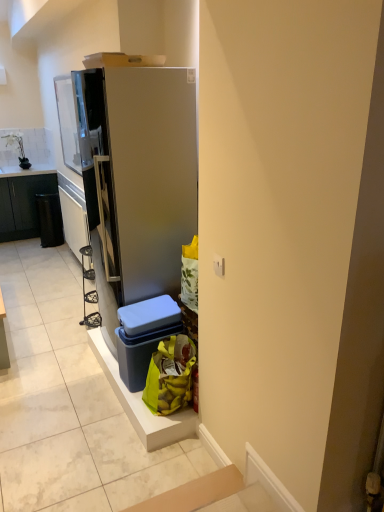
Question: From a real-world perspective, does black plastic recycling bin at left sit lower than blue plastic storage box at lower center?

Choices:
 (A) no
 (B) yes

Answer: (B)

Question: Is black plastic recycling bin at left to the right of blue plastic storage box at lower center from the viewer's perspective?

Choices:
 (A) yes
 (B) no

Answer: (B)

Question: Does black plastic recycling bin at left lie in front of blue plastic storage box at lower center?

Choices:
 (A) yes
 (B) no

Answer: (B)

Question: Would you say black plastic recycling bin at left contains blue plastic storage box at lower center?

Choices:
 (A) yes
 (B) no

Answer: (B)

Question: From the image's perspective, is black plastic recycling bin at left beneath blue plastic storage box at lower center?

Choices:
 (A) yes
 (B) no

Answer: (B)

Question: From the image's perspective, is black plastic recycling bin at left located above blue plastic storage box at lower center?

Choices:
 (A) no
 (B) yes

Answer: (B)

Question: From the image's perspective, is metallic silver shelf at left beneath blue plastic storage box at lower center?

Choices:
 (A) no
 (B) yes

Answer: (A)

Question: Could blue plastic storage box at lower center be considered to be inside metallic silver shelf at left?

Choices:
 (A) no
 (B) yes

Answer: (A)

Question: Considering the relative positions of metallic silver shelf at left and blue plastic storage box at lower center in the image provided, is metallic silver shelf at left behind blue plastic storage box at lower center?

Choices:
 (A) yes
 (B) no

Answer: (A)

Question: Is metallic silver shelf at left completely or partially outside of blue plastic storage box at lower center?

Choices:
 (A) no
 (B) yes

Answer: (B)

Question: Considering the relative sizes of metallic silver shelf at left and blue plastic storage box at lower center in the image provided, is metallic silver shelf at left thinner than blue plastic storage box at lower center?

Choices:
 (A) no
 (B) yes

Answer: (B)

Question: Could you tell me if metallic silver shelf at left is facing blue plastic storage box at lower center?

Choices:
 (A) yes
 (B) no

Answer: (B)

Question: From a real-world perspective, does yellow plastic bag at lower right sit lower than satin silver refrigerator at center?

Choices:
 (A) no
 (B) yes

Answer: (B)